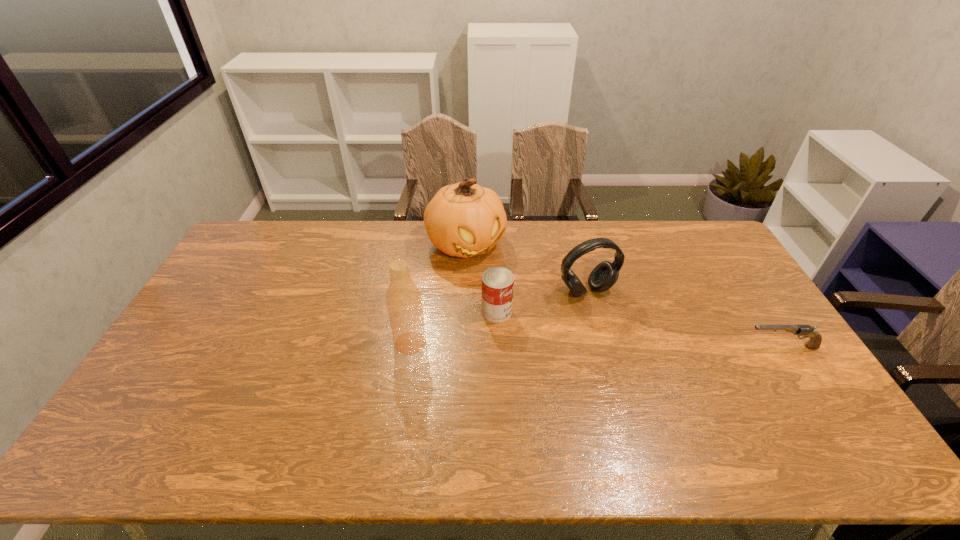
Identify the location of object that is positioned at the far edge. (464, 219).

Where is `object present at the right edge`? object present at the right edge is located at coordinates (807, 331).

Locate an element on the screen. Image resolution: width=960 pixels, height=540 pixels. free space at the far edge is located at coordinates (608, 231).

At what (x,y) coordinates should I click in order to perform the action: click on free space at the near edge of the desktop. Please return your answer as a coordinate pair (x, y). Looking at the image, I should click on (231, 398).

You are a GUI agent. You are given a task and a screenshot of the screen. Output one action in this format:
    pyautogui.click(x=<x>, y=<y>)
    Task: Click on the vacant space at the left edge of the desktop
    The image size is (960, 540).
    Given the screenshot: What is the action you would take?
    pyautogui.click(x=238, y=279)

You are a GUI agent. You are given a task and a screenshot of the screen. Output one action in this format:
    pyautogui.click(x=<x>, y=<y>)
    Task: Click on the free point at the right edge
    
    Given the screenshot: What is the action you would take?
    pyautogui.click(x=733, y=296)

In the image, there is a desktop. Where is `vacant space at the far left corner`? This screenshot has width=960, height=540. vacant space at the far left corner is located at coordinates (253, 247).

In order to click on vacant point at the near left corner in this screenshot , I will do `click(185, 402)`.

Locate an element on the screen. The width and height of the screenshot is (960, 540). vacant space at the far right corner of the desktop is located at coordinates (694, 236).

Where is `free spot at the near right corner of the desktop`? The width and height of the screenshot is (960, 540). free spot at the near right corner of the desktop is located at coordinates (794, 413).